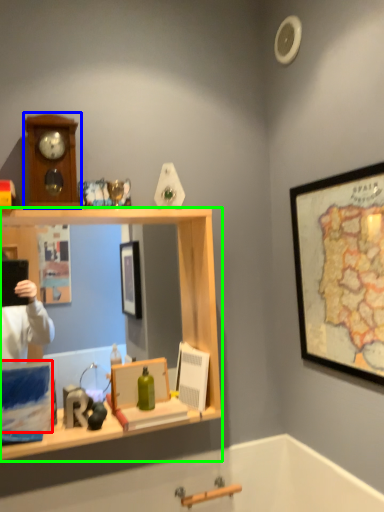
Question: Estimate the real-world distances between objects in this image. Which object is farther from box (highlighted by a red box), clock (highlighted by a blue box) or desk (highlighted by a green box)?

Choices:
 (A) clock
 (B) desk

Answer: (A)